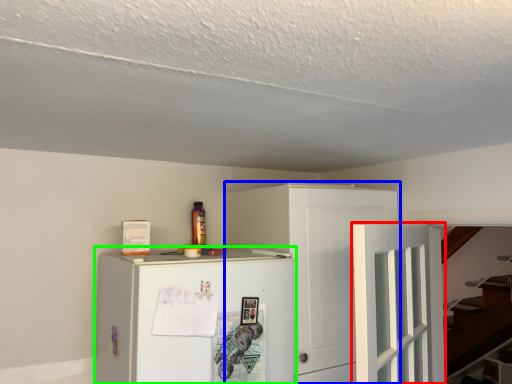
Question: Which object is positioned closest to door (highlighted by a red box)? Select from cabinetry (highlighted by a blue box) and refrigerator (highlighted by a green box).

Choices:
 (A) cabinetry
 (B) refrigerator

Answer: (A)